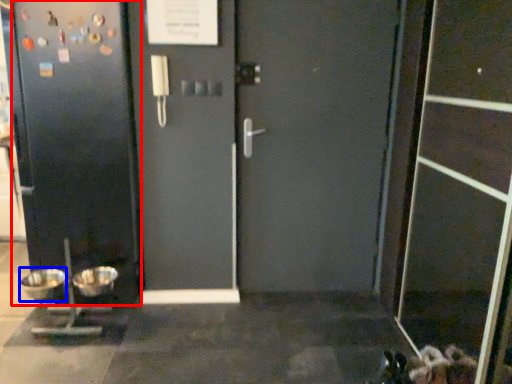
Question: Which point is closer to the camera, door (highlighted by a red box) or mixing bowl (highlighted by a blue box)?

Choices:
 (A) door
 (B) mixing bowl

Answer: (A)